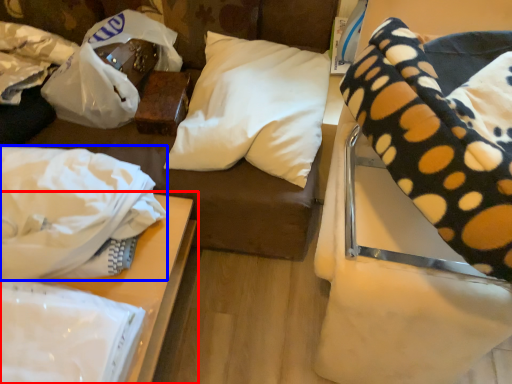
Question: Which object is further to the camera taking this photo, table (highlighted by a red box) or material (highlighted by a blue box)?

Choices:
 (A) table
 (B) material

Answer: (A)